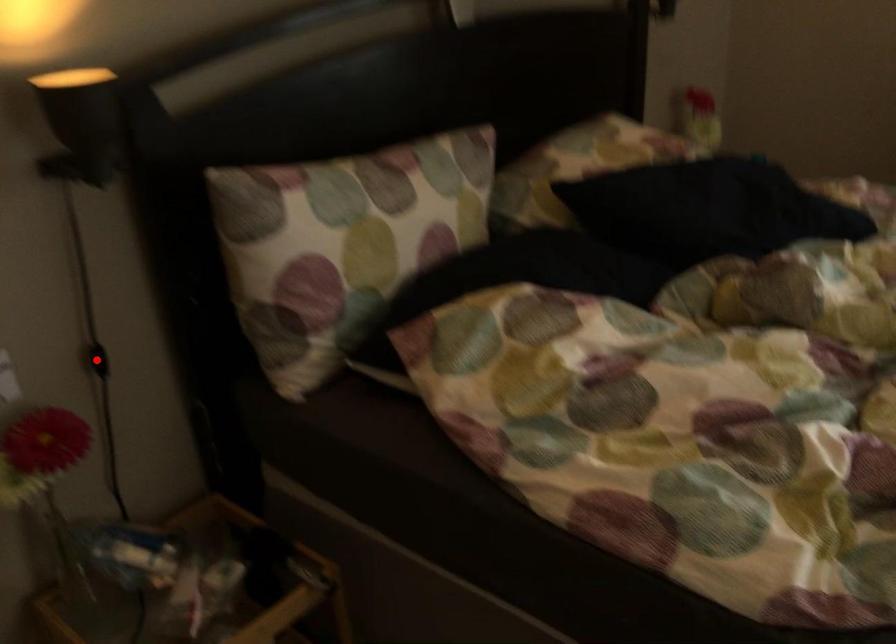
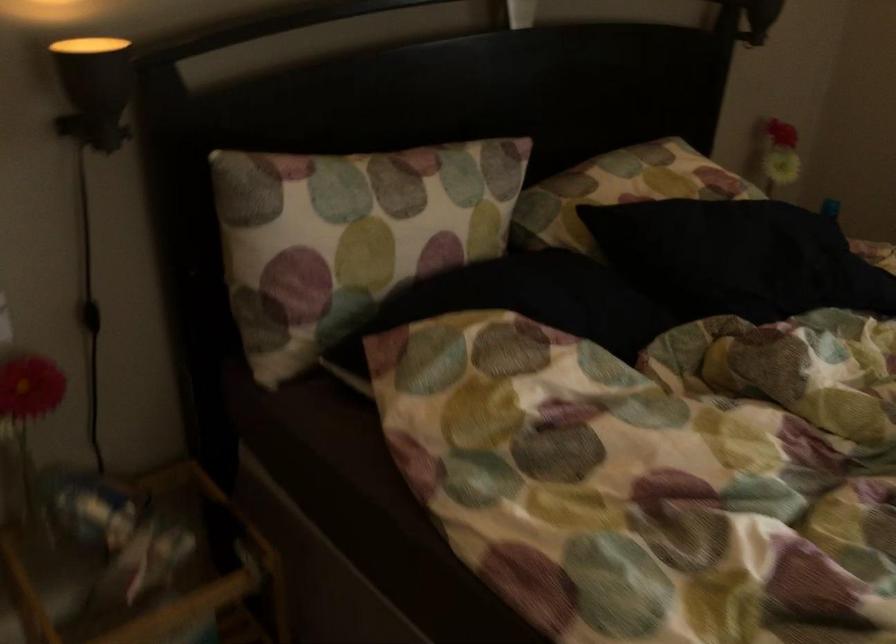
In the second image, find the point that corresponds to the highlighted location in the first image.

(90, 316)